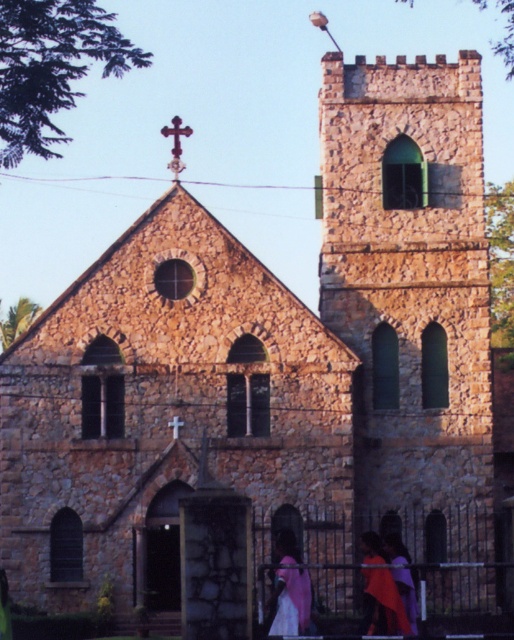
Is stone tower at center to the right of pink fabric at center from the viewer's perspective?

Yes, stone tower at center is to the right of pink fabric at center.

Does stone tower at center lie in front of pink fabric at center?

No, it is behind pink fabric at center.

You are a GUI agent. You are given a task and a screenshot of the screen. Output one action in this format:
    pyautogui.click(x=<x>, y=<y>)
    Task: Click on the stone tower at center
    
    Given the screenshot: What is the action you would take?
    (x=409, y=273)

Is stone tower at center below silky purple dress at lower center?

No.

Is stone tower at center positioned before silky purple dress at lower center?

That is False.

Is point (382, 365) in front of point (387, 580)?

No, it is not.

What are the coordinates of `stone tower at center` in the screenshot? It's located at pos(409,273).

Is point (296, 593) behind point (364, 627)?

No, (296, 593) is closer to viewer.

Based on the photo, between pink fabric at center and silky purple dress at lower center, which one appears on the left side from the viewer's perspective?

pink fabric at center

Which is behind, point (276, 547) or point (372, 612)?

The point (276, 547) is behind.

Identify the location of pink fabric at center. (290, 602).